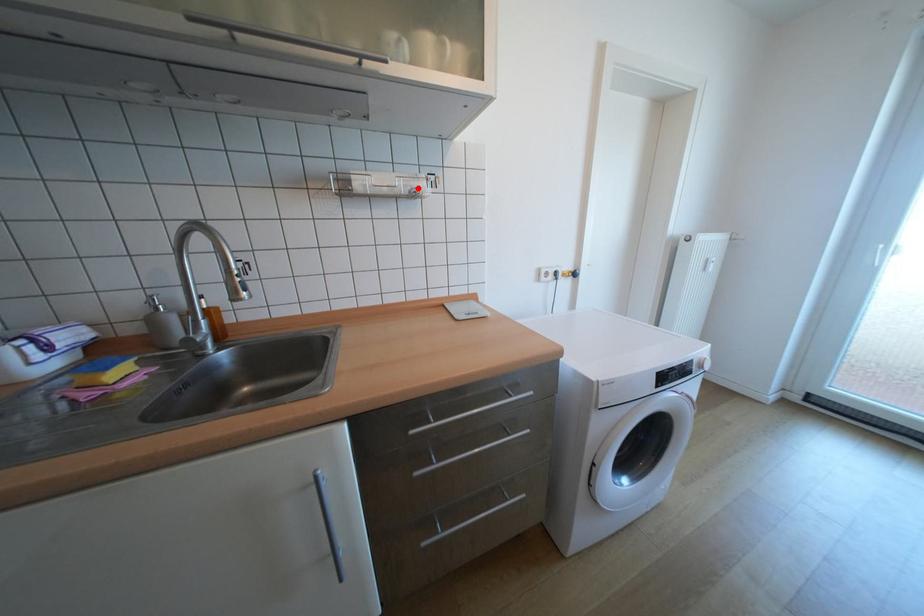
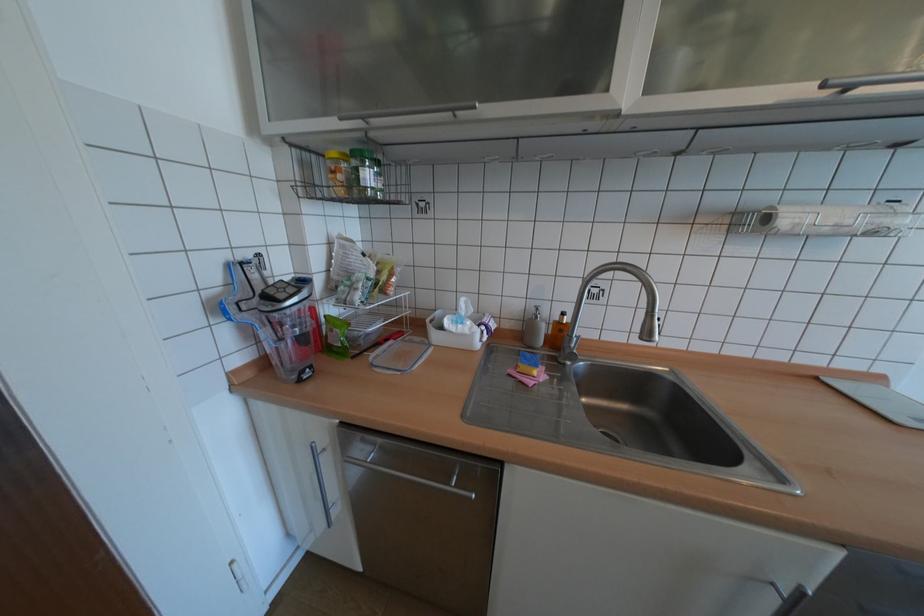
In the second image, find the point that corresponds to the highlighted location in the first image.

(881, 227)